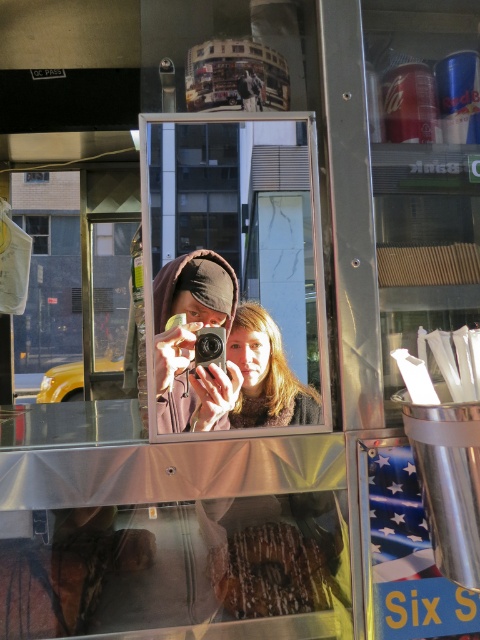
In the scene shown: Does matte brown hair at center lie behind black plastic camera at center?

Yes, it is behind black plastic camera at center.

Is matte brown hair at center to the right of black plastic camera at center from the viewer's perspective?

Yes, matte brown hair at center is to the right of black plastic camera at center.

Which is in front, point (257, 340) or point (196, 374)?

Point (196, 374) is in front.

Identify the location of matte brown hair at center. This screenshot has height=640, width=480. (266, 374).

In the scene shown: Does matte black camera at center come behind black plastic camera at center?

That is False.

Is matte black camera at center below black plastic camera at center?

No, matte black camera at center is not below black plastic camera at center.

The width and height of the screenshot is (480, 640). Describe the element at coordinates (192, 339) in the screenshot. I see `matte black camera at center` at that location.

Where is `matte black camera at center`? matte black camera at center is located at coordinates (192, 339).

Is point (239, 602) positioned before point (244, 333)?

No, it is behind (244, 333).

The height and width of the screenshot is (640, 480). What are the coordinates of `glazed chocolate donut at center` in the screenshot? It's located at (269, 572).

The image size is (480, 640). Find the location of `glazed chocolate donut at center`. glazed chocolate donut at center is located at coordinates (269, 572).